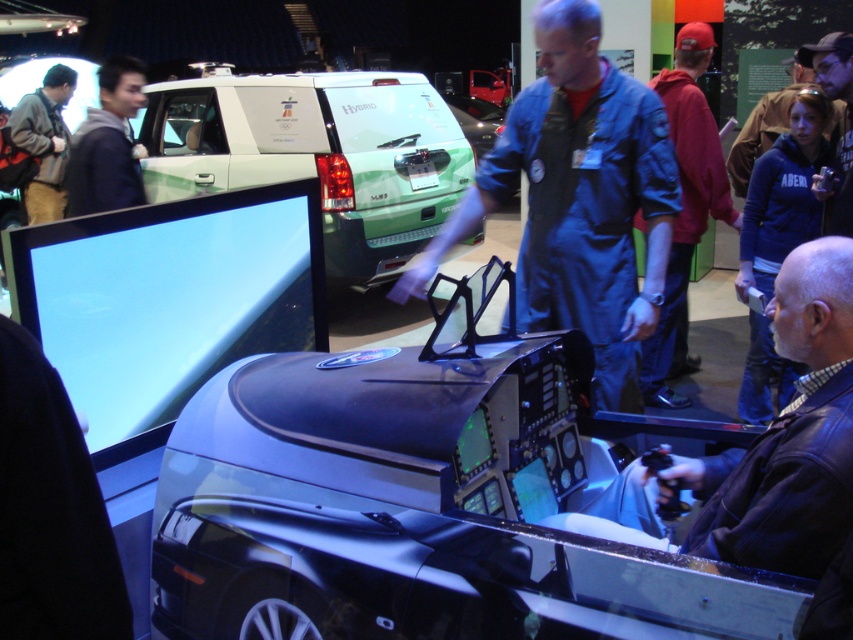
Can you confirm if dark blue hoodie at upper left is thinner than blue fleece jacket at upper right?

Correct, dark blue hoodie at upper left's width is less than blue fleece jacket at upper right's.

From the picture: Does dark blue hoodie at upper left come behind blue fleece jacket at upper right?

No, it is not.

Does point (125, 88) come behind point (741, 144)?

No, it is in front of (741, 144).

You are a GUI agent. You are given a task and a screenshot of the screen. Output one action in this format:
    pyautogui.click(x=<x>, y=<y>)
    Task: Click on the dark blue hoodie at upper left
    This screenshot has width=853, height=640.
    Given the screenshot: What is the action you would take?
    pyautogui.click(x=107, y=145)

Who is shorter, dark blue hoodie at upper left or dark blue leather jacket at upper right?

dark blue hoodie at upper left is shorter.

Is point (83, 193) positioned after point (842, 172)?

Yes.

This screenshot has height=640, width=853. Find the location of `dark blue hoodie at upper left`. dark blue hoodie at upper left is located at coordinates (107, 145).

Is point (630, 483) farther from camera compared to point (775, 100)?

That is False.

Which is above, shiny black cockpit at center or blue fleece jacket at upper right?

blue fleece jacket at upper right is higher up.

Measure the distance between shiny black cockpit at center and camera.

shiny black cockpit at center and camera are 4.37 feet apart.

Find the location of a particular element. The height and width of the screenshot is (640, 853). shiny black cockpit at center is located at coordinates (428, 506).